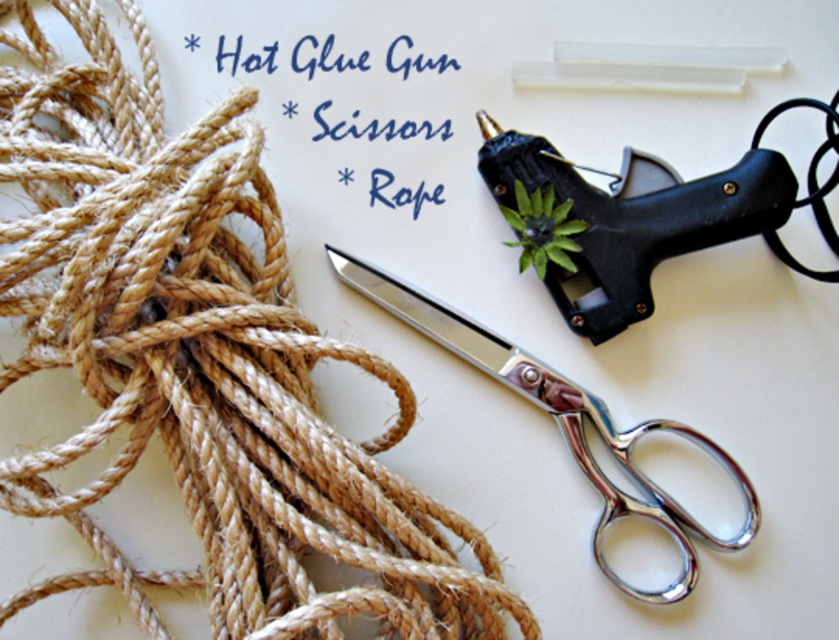
You need to choose between the polished metal scissors at center and the matte black hot glue gun at upper right for a project that requires handling small, delicate tasks. Which tool is more suitable based on their sizes?

The matte black hot glue gun at upper right is smaller in size than the polished metal scissors at center, making it more suitable for handling small, delicate tasks.

You are organizing a craft kit and need to place the polished metal scissors at center and the matte black hot glue gun at upper right into a drawer. The drawer has a divider that separates the front and back sections. If you want to keep the scissors in the front section and the glue gun in the back, can you arrange them based on their current positions?

Yes, you can arrange them as desired because the polished metal scissors at center are already positioned in front of the matte black hot glue gun at upper right. Place the scissors in the front section and the glue gun in the back section accordingly.

You are organizing a crafting session and need to place the polished metal scissors at center exactly at point [564,422]. However, there is a black hot glue gun with a gold colored nozzle to the right of the scissors. Is there enough space to move the scissors to the designated point without overlapping the glue gun?

The polished metal scissors at center is already located at point [564,422], so there is no need to move them. Therefore, there is enough space as they are already positioned correctly without overlapping the black hot glue gun with a gold colored nozzle.